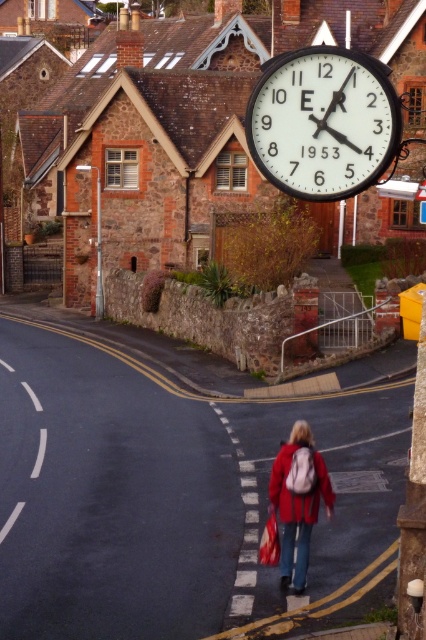
Is black metal clock at upper center above red matte jacket at lower center?

Indeed, black metal clock at upper center is positioned over red matte jacket at lower center.

This screenshot has height=640, width=426. In order to click on black metal clock at upper center in this screenshot , I will do `click(322, 122)`.

I want to click on black metal clock at upper center, so click(x=322, y=122).